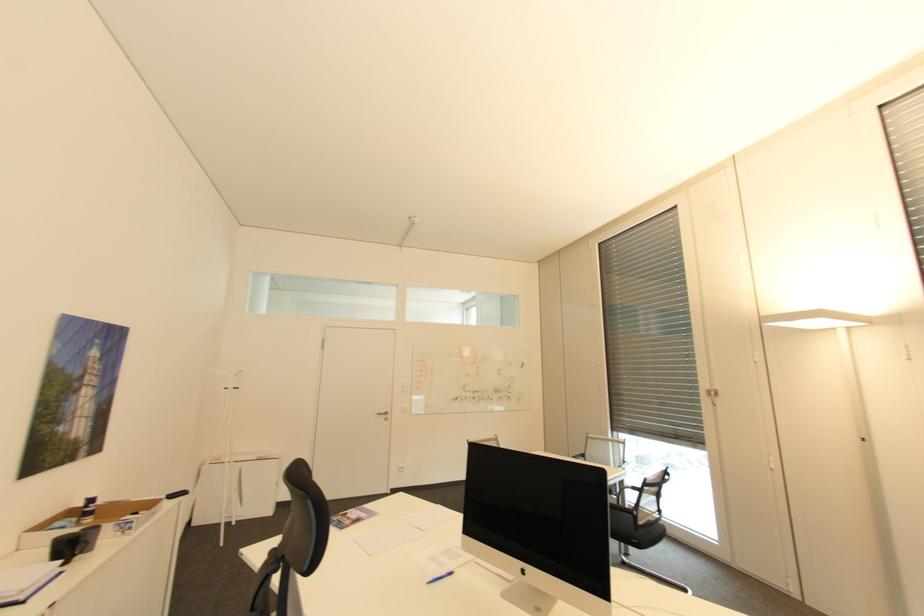
The location [440,577] corresponds to which object?

It refers to a blue ink pen.